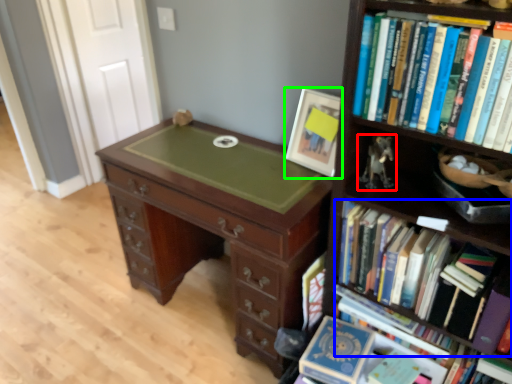
Question: Which object is positioned farthest from toy (highlighted by a red box)? Select from book (highlighted by a blue box) and picture frame (highlighted by a green box).

Choices:
 (A) book
 (B) picture frame

Answer: (A)